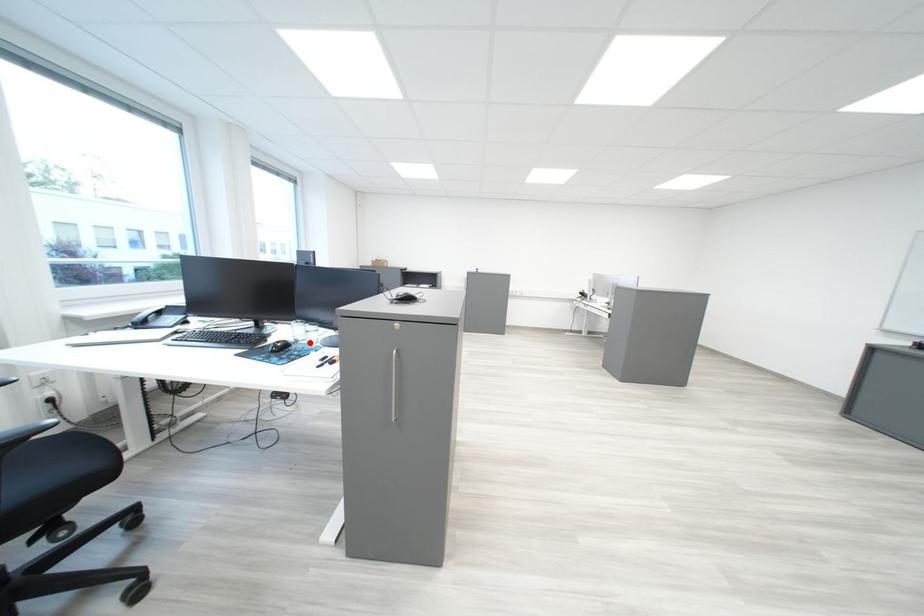
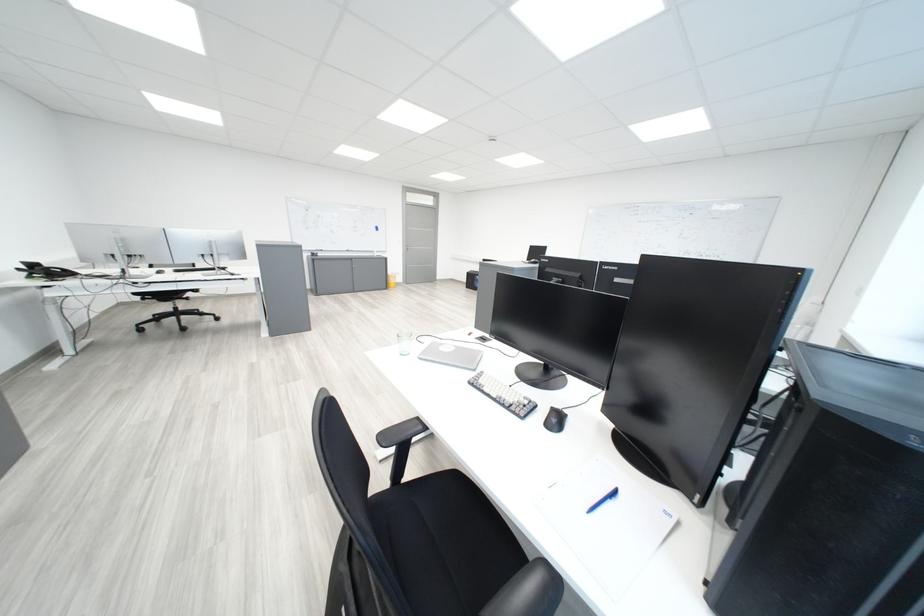
Question: I am providing you with two images of the same scene from different viewpoints. A red point is marked on the first image. Is the red point's position out of view in image 2?

Choices:
 (A) Yes
 (B) No

Answer: (A)